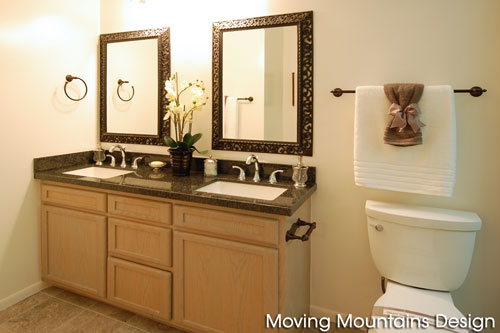
I want to click on flower pot, so click(x=181, y=160).